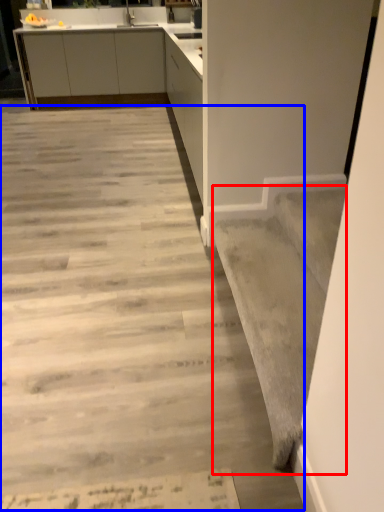
Question: Which of the following is the farthest to the observer, stairwell (highlighted by a red box) or concrete (highlighted by a blue box)?

Choices:
 (A) stairwell
 (B) concrete

Answer: (A)